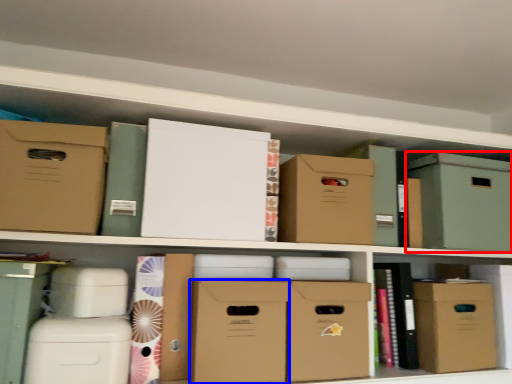
Question: Which object is further to the camera taking this photo, cardboard box (highlighted by a red box) or cardboard box (highlighted by a blue box)?

Choices:
 (A) cardboard box
 (B) cardboard box

Answer: (A)